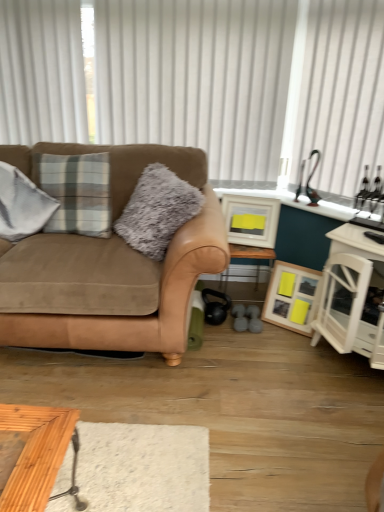
Question: Which direction should I rotate to face matte white picture frame at center, arranged as the second picture frame when ordered from the bottom, — up or down?

Choices:
 (A) up
 (B) down

Answer: (A)

Question: Is wooden picture frame at lower right, which is counted as the 1th picture frame, starting from the bottom, thinner than white sheer curtain at upper right, marked as the second curtain in a left-to-right arrangement?

Choices:
 (A) yes
 (B) no

Answer: (B)

Question: Is wooden picture frame at lower right, which is counted as the 1th picture frame, starting from the bottom, bigger than white sheer curtain at upper right, marked as the second curtain in a left-to-right arrangement?

Choices:
 (A) no
 (B) yes

Answer: (A)

Question: From the image's perspective, is wooden picture frame at lower right, which is counted as the 1th picture frame, starting from the bottom, below white sheer curtain at upper right, marked as the second curtain in a left-to-right arrangement?

Choices:
 (A) yes
 (B) no

Answer: (A)

Question: Is the position of wooden picture frame at lower right, which is counted as the 1th picture frame, starting from the bottom, less distant than that of white sheer curtain at upper right, marked as the second curtain in a left-to-right arrangement?

Choices:
 (A) no
 (B) yes

Answer: (A)

Question: Is wooden picture frame at lower right, which is counted as the 1th picture frame, starting from the bottom, taller than white sheer curtain at upper right, marked as the second curtain in a left-to-right arrangement?

Choices:
 (A) yes
 (B) no

Answer: (B)

Question: From a real-world perspective, is wooden picture frame at lower right, which ranks as the second picture frame in top-to-bottom order, located higher than white sheer curtain at upper right, the first curtain when ordered from right to left?

Choices:
 (A) no
 (B) yes

Answer: (A)

Question: Could you tell me if white vertical blinds at upper center, which appears as the first curtain when viewed from the left, is facing wooden table at center?

Choices:
 (A) yes
 (B) no

Answer: (B)

Question: Does white vertical blinds at upper center, which is the 2th curtain in right-to-left order, have a smaller size compared to wooden table at center?

Choices:
 (A) yes
 (B) no

Answer: (B)

Question: From a real-world perspective, is white vertical blinds at upper center, which is the 2th curtain in right-to-left order, over wooden table at center?

Choices:
 (A) no
 (B) yes

Answer: (B)

Question: Is wooden table at center located within white vertical blinds at upper center, which appears as the first curtain when viewed from the left?

Choices:
 (A) no
 (B) yes

Answer: (A)

Question: Can you confirm if white vertical blinds at upper center, which is the 2th curtain in right-to-left order, is positioned to the right of wooden table at center?

Choices:
 (A) no
 (B) yes

Answer: (A)

Question: Considering the relative sizes of white vertical blinds at upper center, which appears as the first curtain when viewed from the left, and wooden table at center in the image provided, is white vertical blinds at upper center, which appears as the first curtain when viewed from the left, thinner than wooden table at center?

Choices:
 (A) no
 (B) yes

Answer: (B)

Question: Does wooden picture frame at lower right, which ranks as the second picture frame in top-to-bottom order, have a greater width compared to white wood cabinet at right?

Choices:
 (A) yes
 (B) no

Answer: (B)